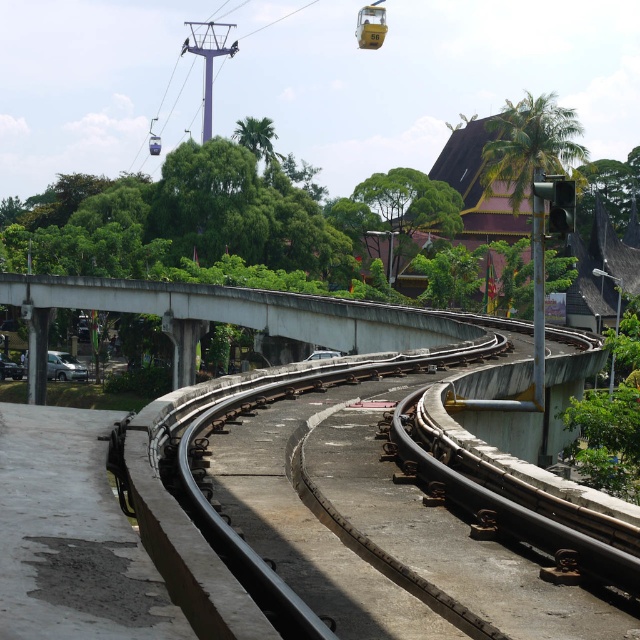
Question: Among these objects, which one is nearest to the camera?

Choices:
 (A) metallic silver cable car at lower left
 (B) concrete at left

Answer: (B)

Question: Which point appears farthest from the camera in this image?

Choices:
 (A) (323, 304)
 (B) (76, 371)

Answer: (B)

Question: Is concrete at left to the left of metallic silver cable car at lower left from the viewer's perspective?

Choices:
 (A) yes
 (B) no

Answer: (B)

Question: Does concrete at left have a larger size compared to metallic silver cable car at lower left?

Choices:
 (A) no
 (B) yes

Answer: (B)

Question: Which point is farther to the camera?

Choices:
 (A) (74, 372)
 (B) (198, 333)

Answer: (A)

Question: Does concrete at left have a lesser width compared to metallic silver cable car at lower left?

Choices:
 (A) yes
 (B) no

Answer: (B)